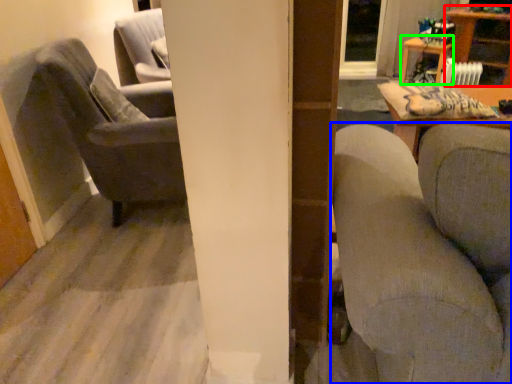
Question: Estimate the real-world distances between objects in this image. Which object is farther from table (highlighted by a red box), studio couch (highlighted by a blue box) or table (highlighted by a green box)?

Choices:
 (A) studio couch
 (B) table

Answer: (A)